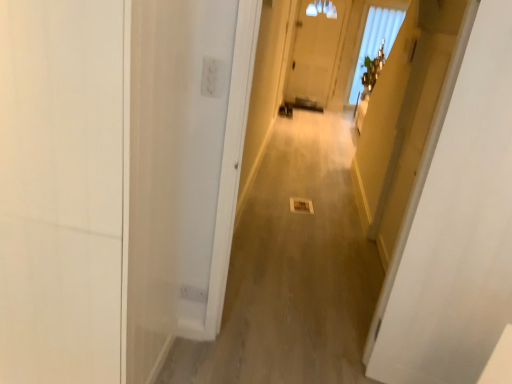
Question: Does white matte door at left, the 1th door viewed from the left, come in front of white glossy door at upper right, arranged as the first door when viewed from the right?

Choices:
 (A) yes
 (B) no

Answer: (A)

Question: Is white matte door at left, positioned as the second door in right-to-left order, surrounding white glossy door at upper right, acting as the second door starting from the left?

Choices:
 (A) no
 (B) yes

Answer: (A)

Question: Can you confirm if white matte door at left, the 1th door viewed from the left, is smaller than white glossy door at upper right, arranged as the first door when viewed from the right?

Choices:
 (A) yes
 (B) no

Answer: (B)

Question: From a real-world perspective, is white matte door at left, positioned as the second door in right-to-left order, under white glossy door at upper right, acting as the second door starting from the left?

Choices:
 (A) yes
 (B) no

Answer: (A)

Question: Does white matte door at left, the 1th door viewed from the left, touch white glossy door at upper right, acting as the second door starting from the left?

Choices:
 (A) yes
 (B) no

Answer: (B)

Question: Relative to white glossy door at upper right, acting as the second door starting from the left, is white matte door at left, the 1th door viewed from the left, in front or behind?

Choices:
 (A) behind
 (B) front

Answer: (B)

Question: In terms of size, does white matte door at left, positioned as the second door in right-to-left order, appear bigger or smaller than white glossy door at upper right, arranged as the first door when viewed from the right?

Choices:
 (A) small
 (B) big

Answer: (B)

Question: Do you think white matte door at left, the 1th door viewed from the left, is within white glossy door at upper right, arranged as the first door when viewed from the right, or outside of it?

Choices:
 (A) outside
 (B) inside

Answer: (A)

Question: Considering the positions of white matte door at left, the 1th door viewed from the left, and white glossy door at upper right, arranged as the first door when viewed from the right, in the image, is white matte door at left, the 1th door viewed from the left, wider or thinner than white glossy door at upper right, arranged as the first door when viewed from the right,?

Choices:
 (A) thin
 (B) wide

Answer: (B)

Question: Is white glossy door at upper right, acting as the second door starting from the left, taller or shorter than white matte door at left, the 1th door viewed from the left?

Choices:
 (A) tall
 (B) short

Answer: (A)

Question: Does point (486, 294) appear closer or farther from the camera than point (119, 261)?

Choices:
 (A) closer
 (B) farther

Answer: (B)

Question: Is white glossy door at upper right, arranged as the first door when viewed from the right, in front of or behind white matte door at left, the 1th door viewed from the left, in the image?

Choices:
 (A) behind
 (B) front

Answer: (A)

Question: Considering the positions of white glossy door at upper right, arranged as the first door when viewed from the right, and white matte door at left, the 1th door viewed from the left, in the image, is white glossy door at upper right, arranged as the first door when viewed from the right, wider or thinner than white matte door at left, the 1th door viewed from the left,?

Choices:
 (A) wide
 (B) thin

Answer: (B)

Question: From their relative heights in the image, would you say white glossy door at upper right, acting as the second door starting from the left, is taller or shorter than translucent glass window at upper center?

Choices:
 (A) tall
 (B) short

Answer: (B)

Question: Would you say white glossy door at upper right, acting as the second door starting from the left, is to the left or to the right of translucent glass window at upper center in the picture?

Choices:
 (A) left
 (B) right

Answer: (A)